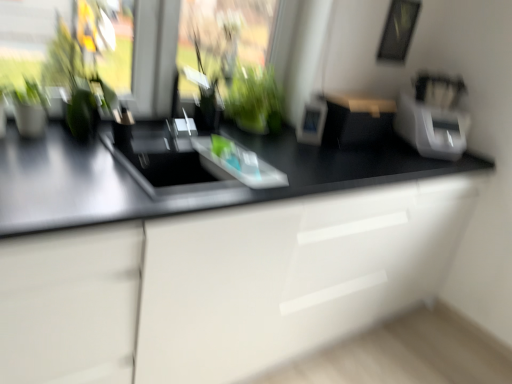
Question: Is green glass vase at center, marked as the 2th window screen in a left-to-right arrangement, thinner than green glossy plant at center?

Choices:
 (A) yes
 (B) no

Answer: (A)

Question: Does green glass vase at center, which ranks as the 1th window screen in right-to-left order, touch green glossy plant at center?

Choices:
 (A) no
 (B) yes

Answer: (A)

Question: Is green glass vase at center, marked as the 2th window screen in a left-to-right arrangement, far from green glossy plant at center?

Choices:
 (A) yes
 (B) no

Answer: (B)

Question: From the image's perspective, is green glass vase at center, marked as the 2th window screen in a left-to-right arrangement, located above green glossy plant at center?

Choices:
 (A) yes
 (B) no

Answer: (A)

Question: Does green glass vase at center, marked as the 2th window screen in a left-to-right arrangement, have a greater width compared to green glossy plant at center?

Choices:
 (A) no
 (B) yes

Answer: (A)

Question: Can you confirm if green glass vase at center, which ranks as the 1th window screen in right-to-left order, is taller than green glossy plant at center?

Choices:
 (A) yes
 (B) no

Answer: (A)

Question: Could you tell me if white plastic photo frame at center, arranged as the third appliance when viewed from the right, is turned towards green glass vase at center, which ranks as the 1th window screen in right-to-left order?

Choices:
 (A) yes
 (B) no

Answer: (B)

Question: From a real-world perspective, is white plastic photo frame at center, arranged as the third appliance when viewed from the right, physically below green glass vase at center, which ranks as the 1th window screen in right-to-left order?

Choices:
 (A) no
 (B) yes

Answer: (B)

Question: Is white plastic photo frame at center, the 1th appliance positioned from the left, to the right of green glass vase at center, which ranks as the 1th window screen in right-to-left order, from the viewer's perspective?

Choices:
 (A) yes
 (B) no

Answer: (A)

Question: Is green glass vase at center, marked as the 2th window screen in a left-to-right arrangement, at the back of white plastic photo frame at center, arranged as the third appliance when viewed from the right?

Choices:
 (A) no
 (B) yes

Answer: (A)

Question: Does white plastic photo frame at center, the 1th appliance positioned from the left, have a greater width compared to green glass vase at center, marked as the 2th window screen in a left-to-right arrangement?

Choices:
 (A) no
 (B) yes

Answer: (A)

Question: Considering the relative sizes of white plastic photo frame at center, arranged as the third appliance when viewed from the right, and green glass vase at center, marked as the 2th window screen in a left-to-right arrangement, in the image provided, is white plastic photo frame at center, arranged as the third appliance when viewed from the right, shorter than green glass vase at center, marked as the 2th window screen in a left-to-right arrangement,?

Choices:
 (A) no
 (B) yes

Answer: (B)

Question: Considering the relative positions of transparent glass window screen at upper left, the 1th window screen viewed from the left, and matte black box at center, the second appliance when ordered from left to right, in the image provided, is transparent glass window screen at upper left, the 1th window screen viewed from the left, to the right of matte black box at center, the second appliance when ordered from left to right, from the viewer's perspective?

Choices:
 (A) yes
 (B) no

Answer: (B)